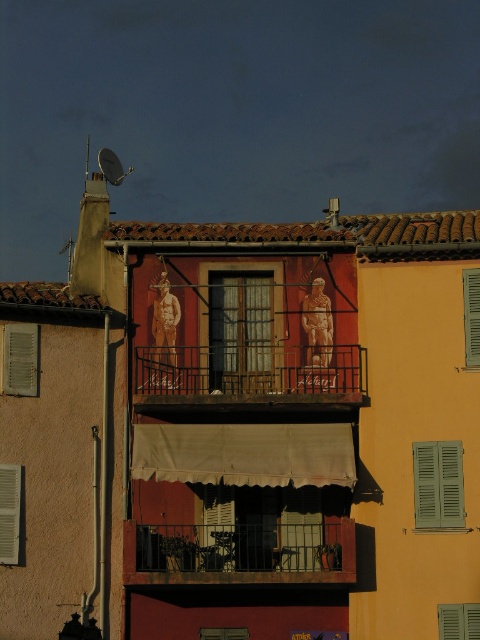
Question: Is green matte shutter at center to the left of green matte shutter at upper center from the viewer's perspective?

Choices:
 (A) yes
 (B) no

Answer: (B)

Question: Is rustic metal balcony at center to the left of green matte shutter at upper right from the viewer's perspective?

Choices:
 (A) no
 (B) yes

Answer: (B)

Question: Estimate the real-world distances between objects in this image. Which object is farther from the green matte shutter at upper right?

Choices:
 (A) green matte shutter at center
 (B) green wooden shutter at left
 (C) green matte shutters at center
 (D) green matte shutter at upper center

Answer: (B)

Question: Is green matte shutter at left thinner than green matte shutter at lower right?

Choices:
 (A) no
 (B) yes

Answer: (B)

Question: Among these objects, which one is farthest from the camera?

Choices:
 (A) green matte shutter at lower right
 (B) green matte shutter at upper right

Answer: (B)

Question: Considering the real-world distances, which object is closest to the rustic metal balcony at center?

Choices:
 (A) green matte shutter at upper center
 (B) green matte shutters at center

Answer: (A)